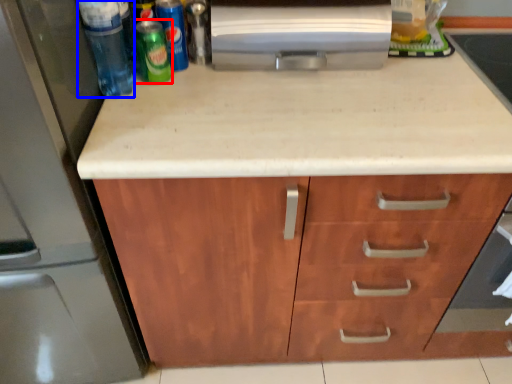
Question: Which point is further to the camera, beer (highlighted by a red box) or beverage (highlighted by a blue box)?

Choices:
 (A) beer
 (B) beverage

Answer: (A)